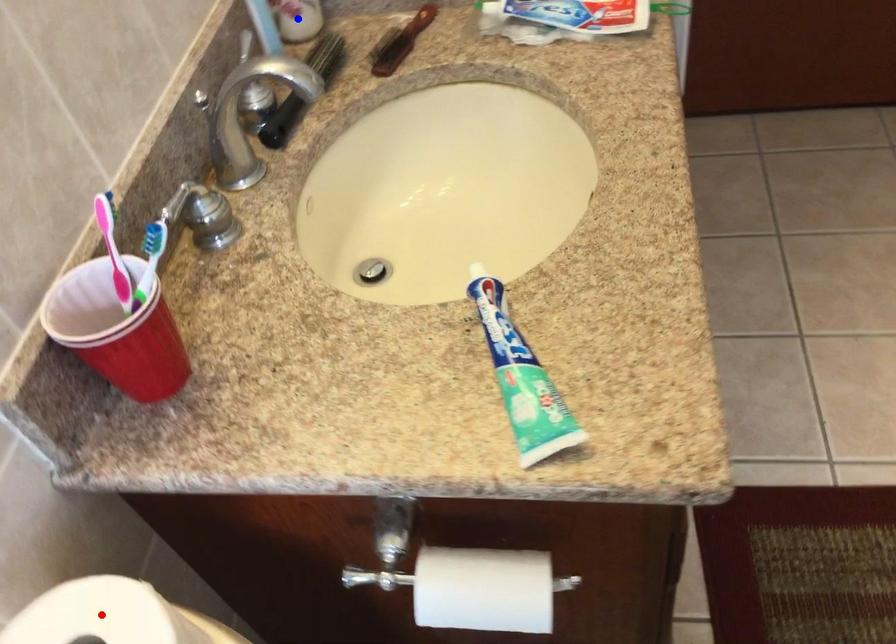
Question: In the image, two points are highlighted. Which point is nearer to the camera? Reply with the corresponding letter.

Choices:
 (A) blue point
 (B) red point

Answer: (B)